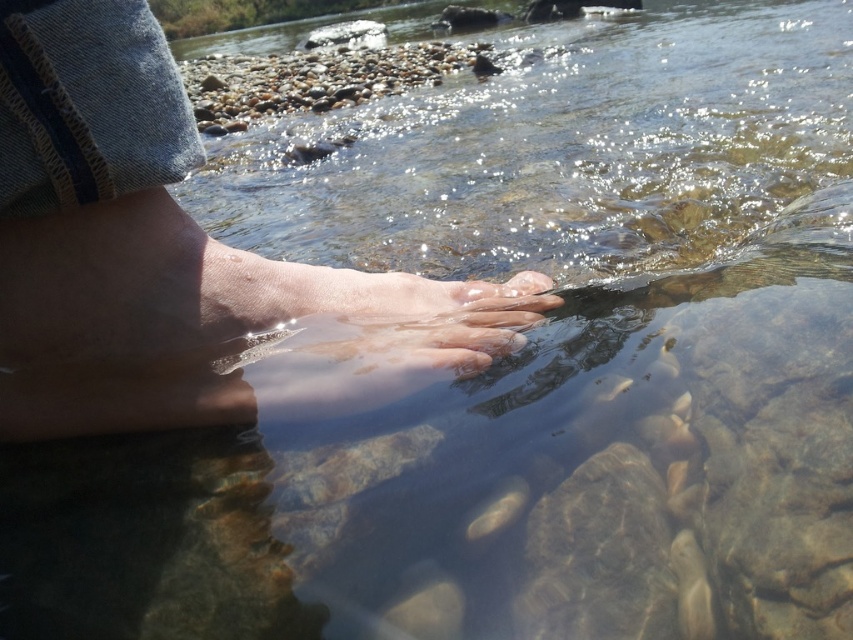
Which of these two, smooth skin foot at center or translucent flesh at center, stands taller?

Standing taller between the two is smooth skin foot at center.

Measure the distance between smooth skin foot at center and camera.

smooth skin foot at center and camera are 13.99 inches apart from each other.

Identify the location of smooth skin foot at center. (160, 248).

The image size is (853, 640). Find the location of `smooth skin foot at center`. smooth skin foot at center is located at coordinates 160,248.